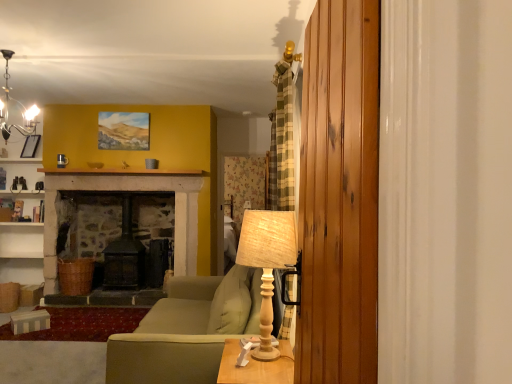
Identify the location of free space below wooden table lamp at center (from a real-world perspective). (266, 347).